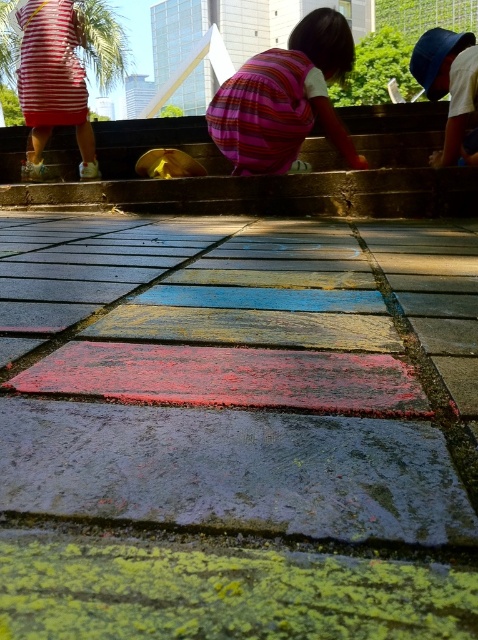
Question: Which point is closer to the camera?

Choices:
 (A) pink striped dress at center
 (B) painted concrete pavement at center

Answer: (B)

Question: Is painted concrete pavement at center below blue plastic bucket at upper center?

Choices:
 (A) yes
 (B) no

Answer: (A)

Question: Observing the image, what is the correct spatial positioning of painted concrete pavement at center in reference to smooth concrete stairs at center?

Choices:
 (A) left
 (B) right

Answer: (B)

Question: Is smooth concrete stairs at center positioned at the back of pink striped dress at center?

Choices:
 (A) no
 (B) yes

Answer: (B)

Question: Which of the following is the farthest from the observer?

Choices:
 (A) blue plastic bucket at upper center
 (B) pink striped dress at center
 (C) striped fabric dress at upper left

Answer: (C)

Question: Which point is farther to the camera?

Choices:
 (A) striped fabric dress at upper left
 (B) pink striped dress at center
 (C) painted concrete pavement at center
 (D) blue plastic bucket at upper center

Answer: (A)